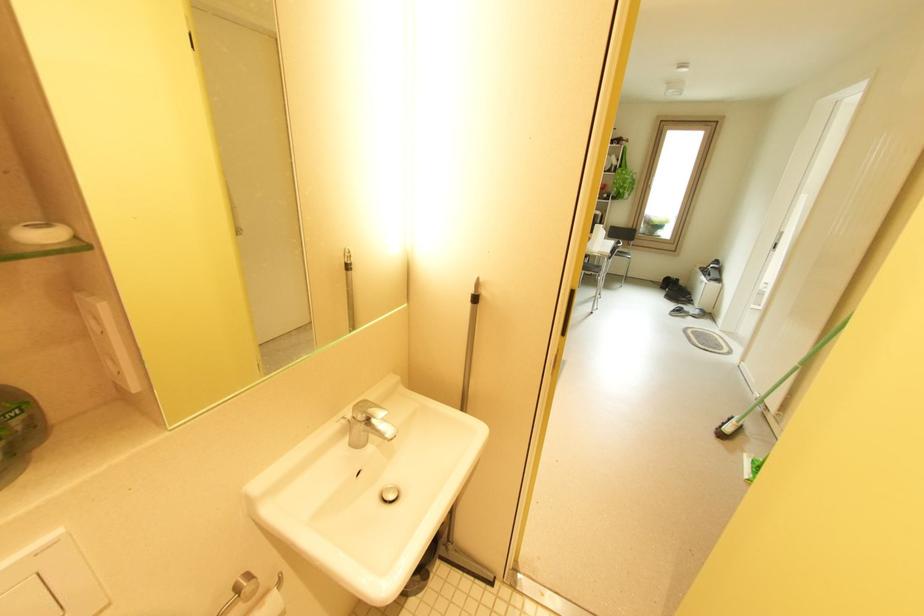
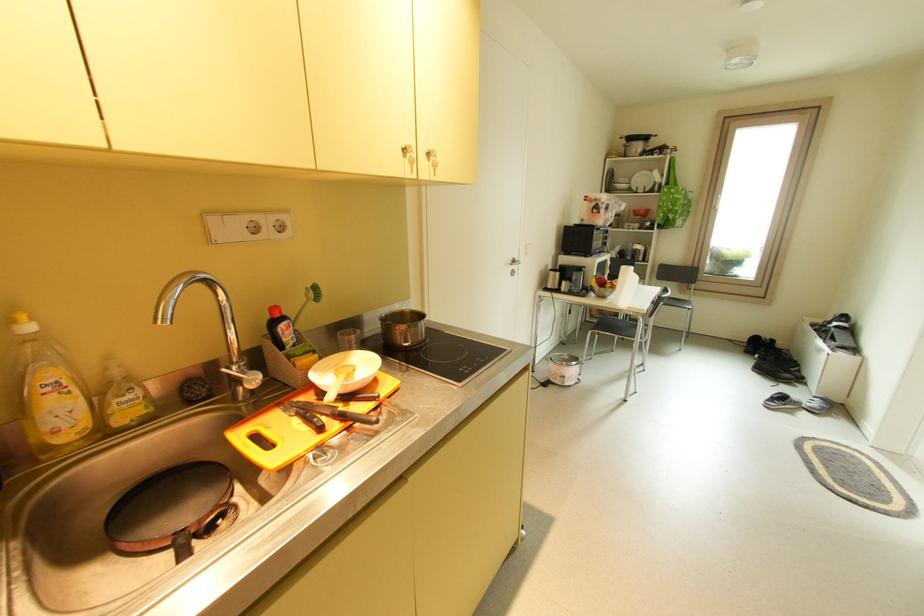
Find the pixel in the second image that matches (x=617, y=252) in the first image.

(662, 304)